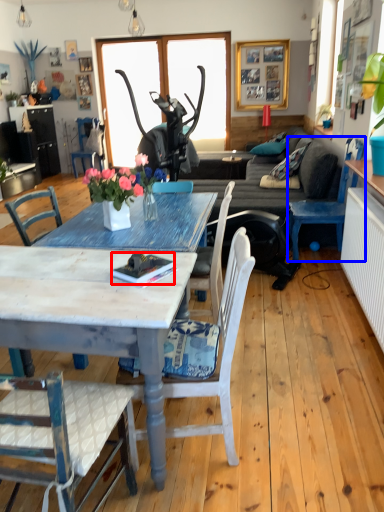
Question: Which object is further to the camera taking this photo, book (highlighted by a red box) or chair (highlighted by a blue box)?

Choices:
 (A) book
 (B) chair

Answer: (B)